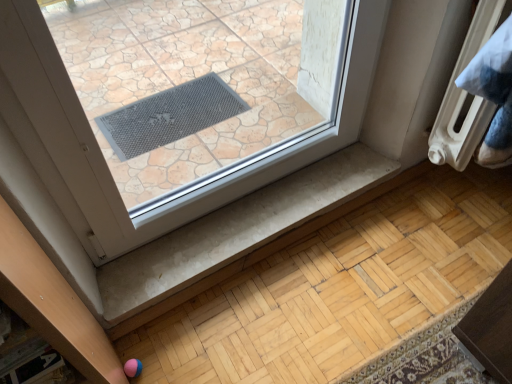
Where is `empty space that is ontop of white matte stair at lower center (from a real-world perspective)`? This screenshot has width=512, height=384. empty space that is ontop of white matte stair at lower center (from a real-world perspective) is located at coordinates (254, 216).